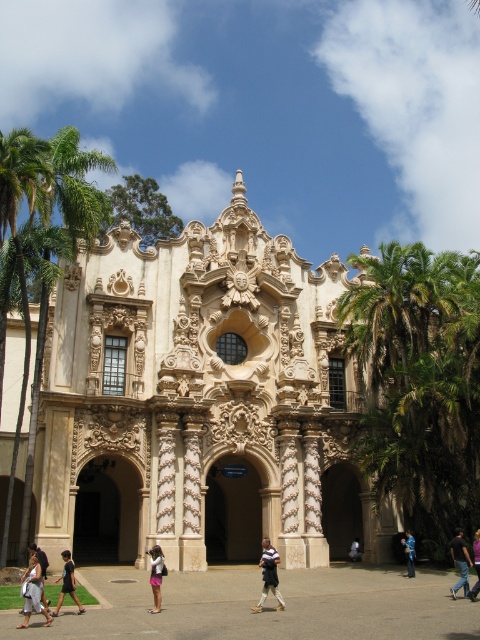
You are standing in front of the grand Spanish Colonial Revival building and notice a light brown leather jacket at center and a camera somewhere in the scene. How far apart are these two items?

The light brown leather jacket at center and camera are 129.32 feet apart from each other.

You are standing in front of the grand Spanish Colonial Revival building and notice a green leafy palm tree at left and a light brown leather bag at lower left. Which object is taller?

The green leafy palm tree at left is taller than the light brown leather bag at lower left.